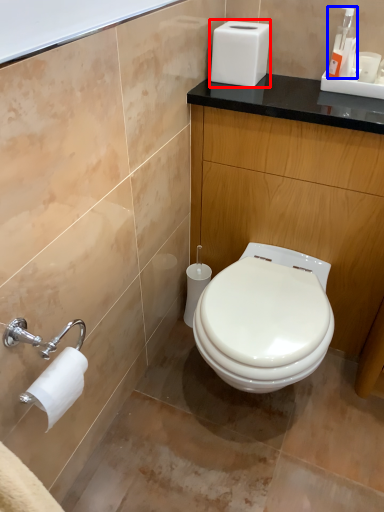
Question: Which object is further to the camera taking this photo, appliance (highlighted by a red box) or soap dispenser (highlighted by a blue box)?

Choices:
 (A) appliance
 (B) soap dispenser

Answer: (A)